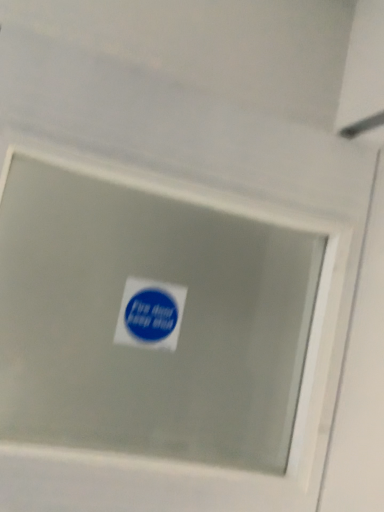
Measure the distance between point (179, 326) and camera.

Point (179, 326) is 29.69 inches away from camera.

The height and width of the screenshot is (512, 384). What do you see at coordinates (150, 314) in the screenshot?
I see `blue paper sticker at center` at bounding box center [150, 314].

The width and height of the screenshot is (384, 512). I want to click on blue paper sticker at center, so click(150, 314).

What are the coordinates of `blue paper sticker at center` in the screenshot? It's located at (150, 314).